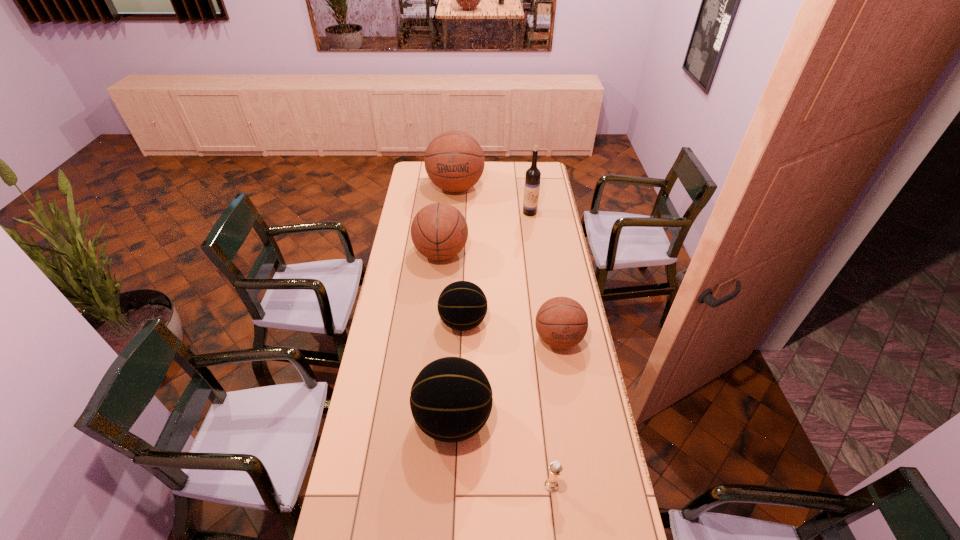
This screenshot has height=540, width=960. Find the location of `free point that satisfies the following two spatial constraints: 1. on the side with brand label of the smaller black basketball; 2. on the left side of the second smallest brown basketball`. free point that satisfies the following two spatial constraints: 1. on the side with brand label of the smaller black basketball; 2. on the left side of the second smallest brown basketball is located at coordinates (435, 322).

Identify the location of free region that satisfies the following two spatial constraints: 1. on the side with brand label of the farther black basketball; 2. on the left side of the tallest basketball. (446, 322).